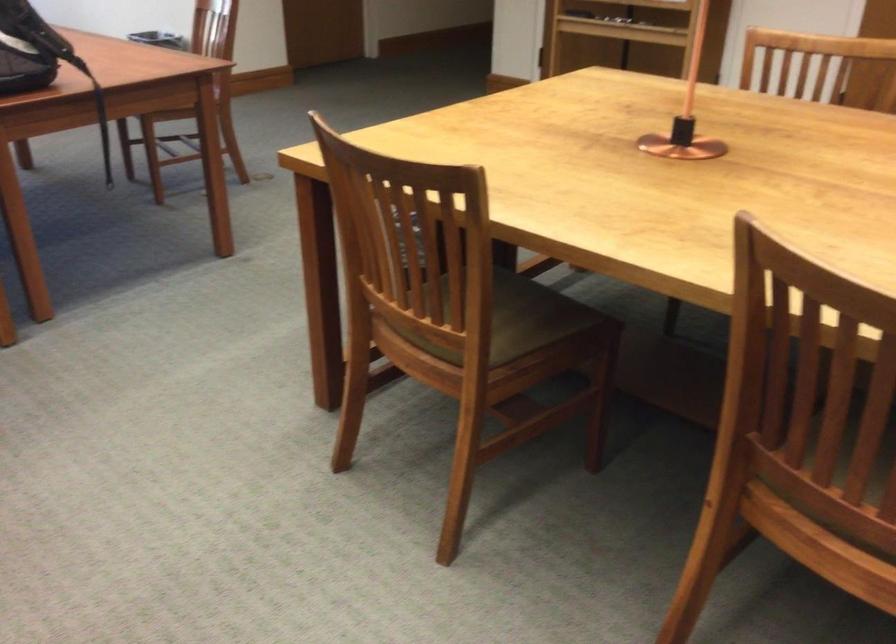
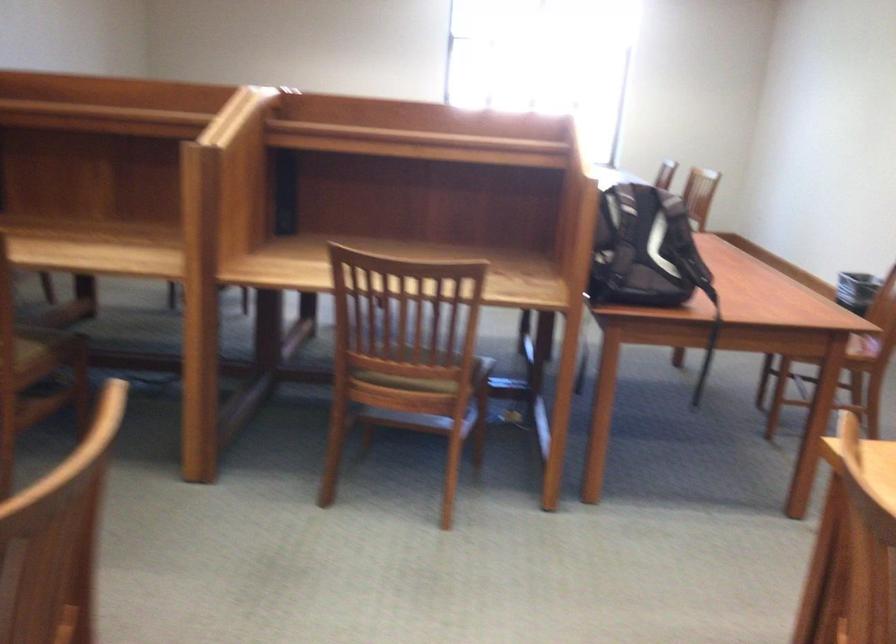
Question: How did the camera likely rotate?

Choices:
 (A) Left
 (B) Right
 (C) Up
 (D) Down

Answer: (A)